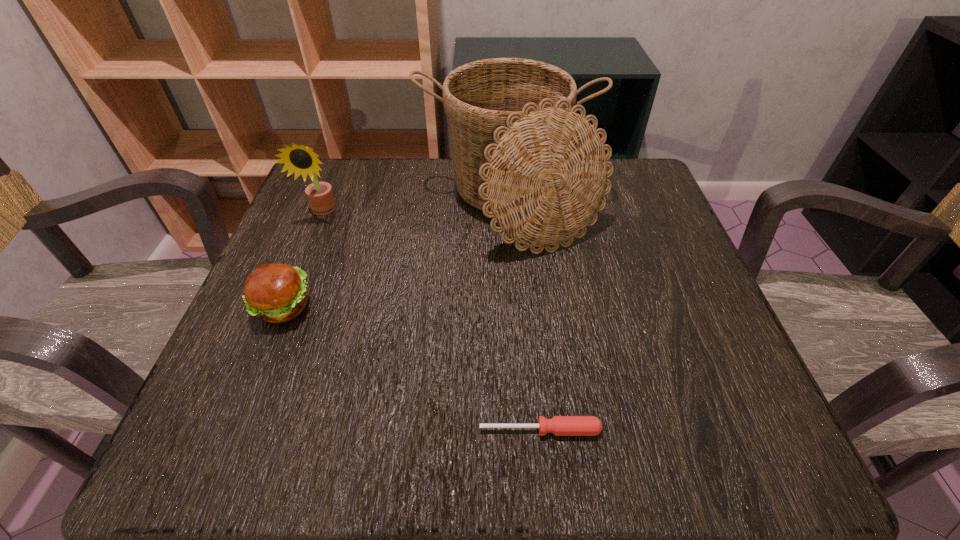
What are the coordinates of `the tallest object` in the screenshot? It's located at point(521,153).

Locate an element on the screen. The width and height of the screenshot is (960, 540). the second tallest object is located at coordinates (302, 160).

Find the location of a particular element. Image resolution: width=960 pixels, height=540 pixels. hamburger is located at coordinates (276, 293).

Locate an element on the screen. The width and height of the screenshot is (960, 540). the second nearest object is located at coordinates (276, 293).

The height and width of the screenshot is (540, 960). Identify the location of the shortest object. (559, 425).

The width and height of the screenshot is (960, 540). I want to click on screwdriver, so click(559, 425).

The height and width of the screenshot is (540, 960). I want to click on free space located on the front of the tallest object, so click(516, 309).

Locate an element on the screen. free space located on the face of the sunflower is located at coordinates (273, 334).

The image size is (960, 540). I want to click on free space located 0.400m on the right of the third farthest object, so point(545,307).

Image resolution: width=960 pixels, height=540 pixels. Identify the location of free space located on the left of the shortest object. (284, 430).